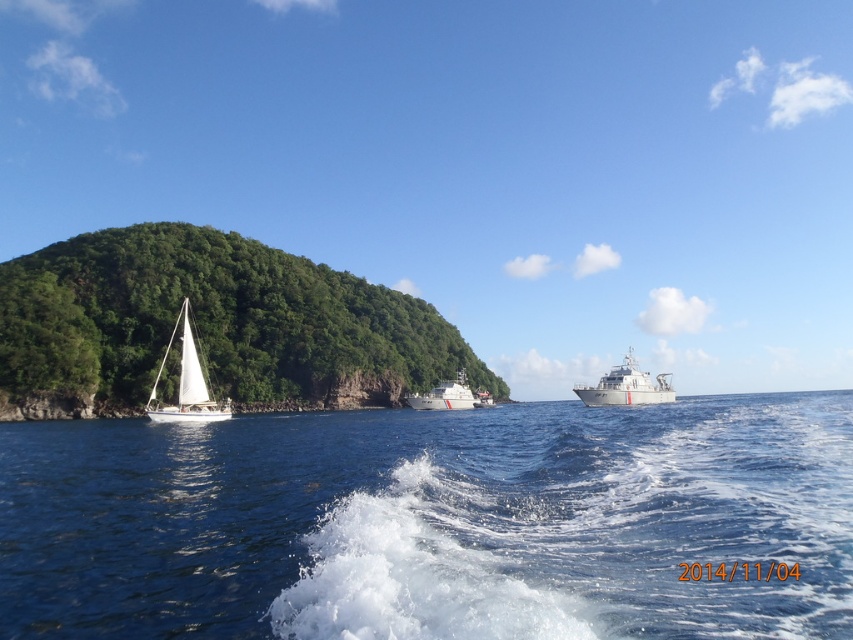
You are a sailor planning to navigate between the white sailboat at left and the white glossy boat at center. Given that your ship has a 30 meter safety distance requirement between obstacles, can you safely pass between them?

The distance between the white sailboat at left and the white glossy boat at center is 32.97 meters, which exceeds the 30 meter safety requirement. Therefore, you can safely pass between them.

Based on the photo, you are a sailor navigating a boat between the green leafy island at left and the white glossy ship at center. Which object is closer to your boat if you are positioned at the center of the image?

The green leafy island at left is closer to your boat because it is positioned further to the viewer compared to the white glossy ship at center, which is farther away.

You are standing on the green hill on the left side of the image. You see a point marked at coordinates [186,385]. What object does this point correspond to?

The point at coordinates [186,385] corresponds to the white sailboat at left.